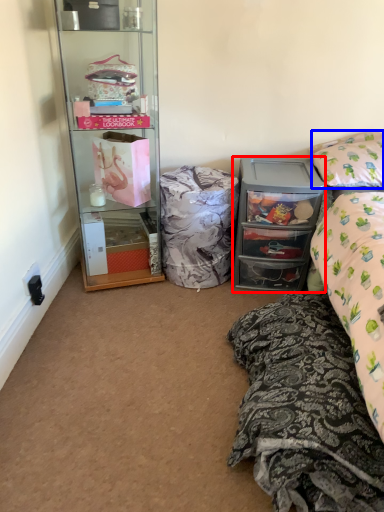
Question: Among these objects, which one is farthest to the camera, cabinetry (highlighted by a red box) or pillow (highlighted by a blue box)?

Choices:
 (A) cabinetry
 (B) pillow

Answer: (A)